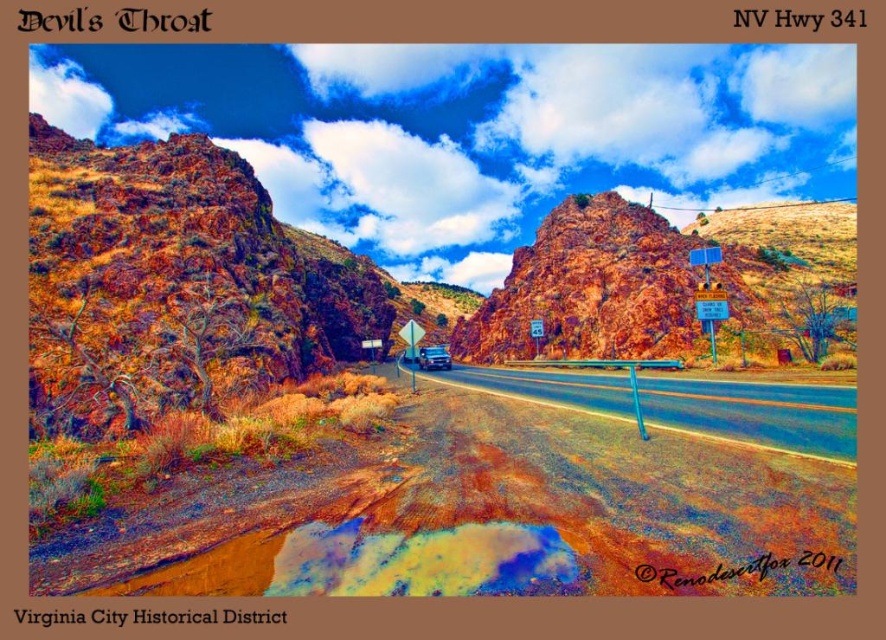
Can you confirm if rusty rock formation at left is positioned to the right of rustic rock formation at center?

Incorrect, rusty rock formation at left is not on the right side of rustic rock formation at center.

Which is behind, point (131, 148) or point (535, 285)?

Positioned behind is point (535, 285).

Who is more distant from viewer, (340,276) or (522,342)?

The point (340,276) is behind.

Locate an element on the screen. This screenshot has height=640, width=886. rusty rock formation at left is located at coordinates (177, 284).

This screenshot has height=640, width=886. What do you see at coordinates (177, 284) in the screenshot?
I see `rusty rock formation at left` at bounding box center [177, 284].

Is rusty rock formation at left behind smooth asphalt highway at center?

Yes, rusty rock formation at left is behind smooth asphalt highway at center.

Is point (123, 157) farther from viewer compared to point (494, 369)?

Yes, point (123, 157) is farther from viewer.

At what (x,y) coordinates should I click in order to perform the action: click on rusty rock formation at left. Please return your answer as a coordinate pair (x, y). Looking at the image, I should click on (177, 284).

Between point (550, 272) and point (713, 344), which one is positioned in front?

Point (713, 344)

Between rustic rock formation at center and yellow plastic sign at right, which one appears on the left side from the viewer's perspective?

yellow plastic sign at right

Who is more distant from viewer, [768,221] or [706,273]?

The point [768,221] is more distant.

At what (x,y) coordinates should I click in order to perform the action: click on rustic rock formation at center. Please return your answer as a coordinate pair (x, y). Looking at the image, I should click on (636, 280).